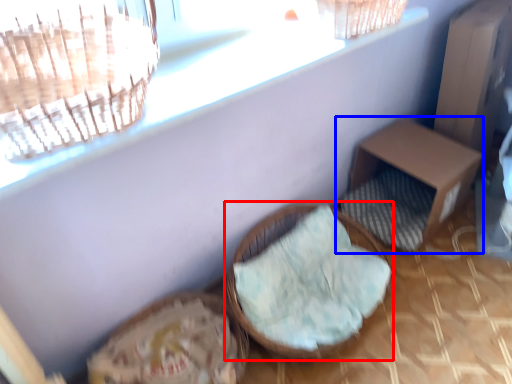
Question: Which point is closer to the camera, furniture (highlighted by a red box) or furniture (highlighted by a blue box)?

Choices:
 (A) furniture
 (B) furniture

Answer: (A)